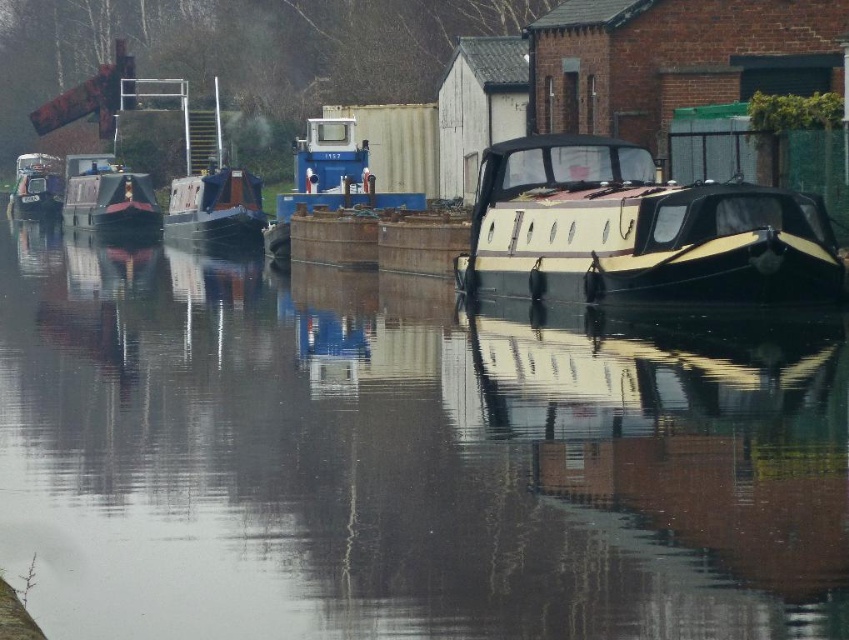
Question: Which object is positioned farthest from the matte black barge at center?

Choices:
 (A) blue metallic barge at center
 (B) glossy water at center
 (C) matte black boat at left
 (D) shiny black boat at left

Answer: (C)

Question: Which object is the closest to the matte black boat at left?

Choices:
 (A) blue metallic barge at center
 (B) matte black barge at center
 (C) glossy water at center
 (D) black polished wood boat at center

Answer: (B)

Question: Can you confirm if black polished wood boat at center is positioned to the right of shiny black boat at left?

Choices:
 (A) yes
 (B) no

Answer: (A)

Question: Is black polished wood boat at center wider than matte black boat at left?

Choices:
 (A) yes
 (B) no

Answer: (B)

Question: Estimate the real-world distances between objects in this image. Which object is closer to the glossy water at center?

Choices:
 (A) black polished wood boat at center
 (B) matte black barge at center
 (C) shiny black boat at left
 (D) matte black boat at left

Answer: (A)

Question: Can you confirm if matte black barge at center is thinner than shiny black boat at left?

Choices:
 (A) yes
 (B) no

Answer: (A)